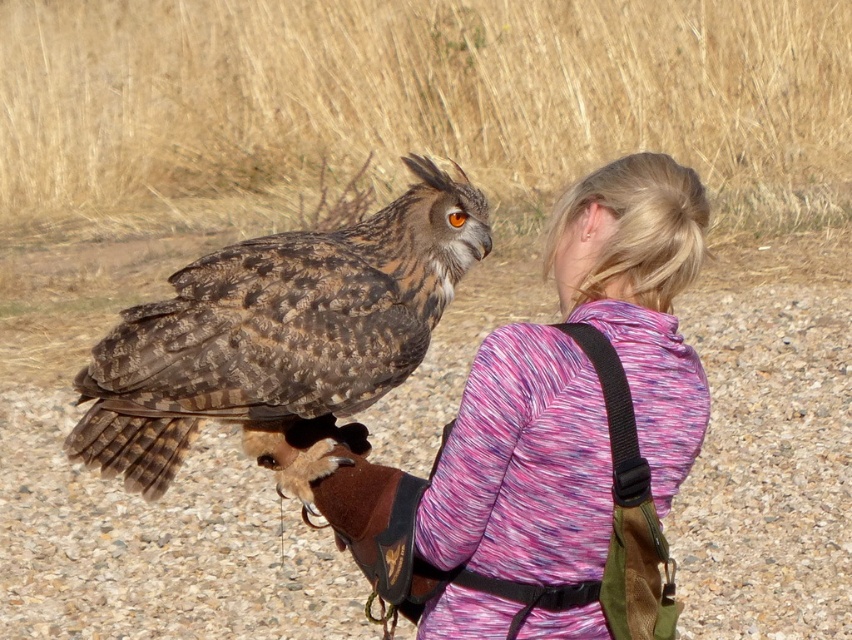
You are a photographer standing 6 meters away from the camera. You want to take a closeup photo of the brown textured glove at center. Is the glove within your reach to adjust its position?

The brown textured glove at center is 6.68 meters away from the camera. Since you are standing 6 meters away from the camera, the glove is 0.68 meters further away from you, so it is within reach to adjust its position.

You are a photographer trying to capture the owl on the person. You notice the brown textured glove at center and the multicolored fleece at center. Which object should you focus on to ensure the owl stays in the frame?

The brown textured glove at center is smaller than the multicolored fleece at center, so focusing on the multicolored fleece at center will help keep the owl in the frame since it is larger and provides a better reference point.

You are a hiker who just found a multicolored fleece at center. You want to place it in your backpack which is located at point 0.5, 0.5. Can you move it directly to your backpack without moving the owl?

The multicolored fleece at center is located at point (551, 440), which is further away from your backpack at (426, 320) than the owl. Since the owl is on your hand, you can move the fleece to the backpack by carefully placing the owl aside first.